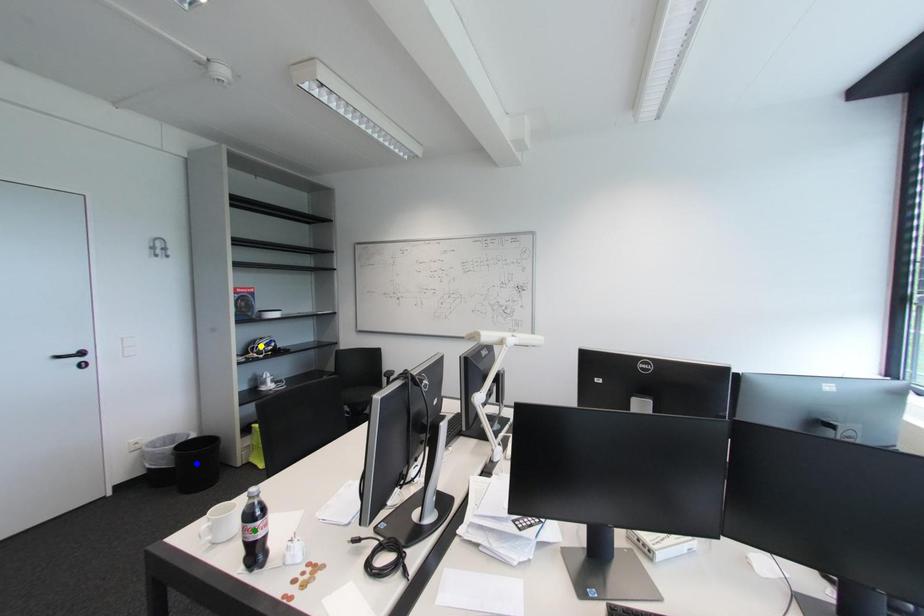
Order these from nearest to farthest:
blue point | green point | yellow point

green point, blue point, yellow point